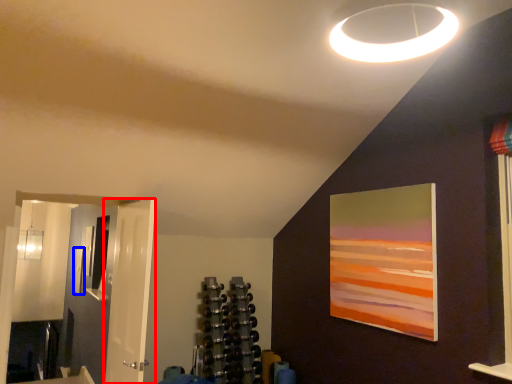
Question: Which object appears farthest to the camera in this image, door (highlighted by a red box) or picture frame (highlighted by a blue box)?

Choices:
 (A) door
 (B) picture frame

Answer: (B)